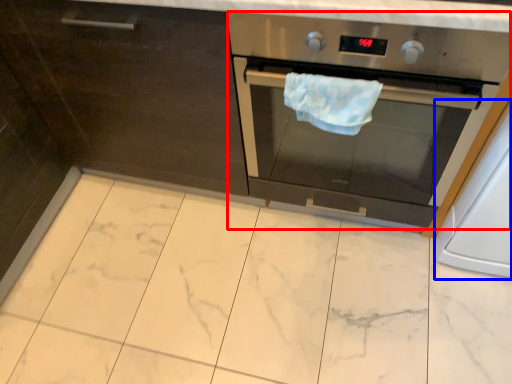
Question: Which point is further to the camera, home appliance (highlighted by a red box) or appliance (highlighted by a blue box)?

Choices:
 (A) home appliance
 (B) appliance

Answer: (B)